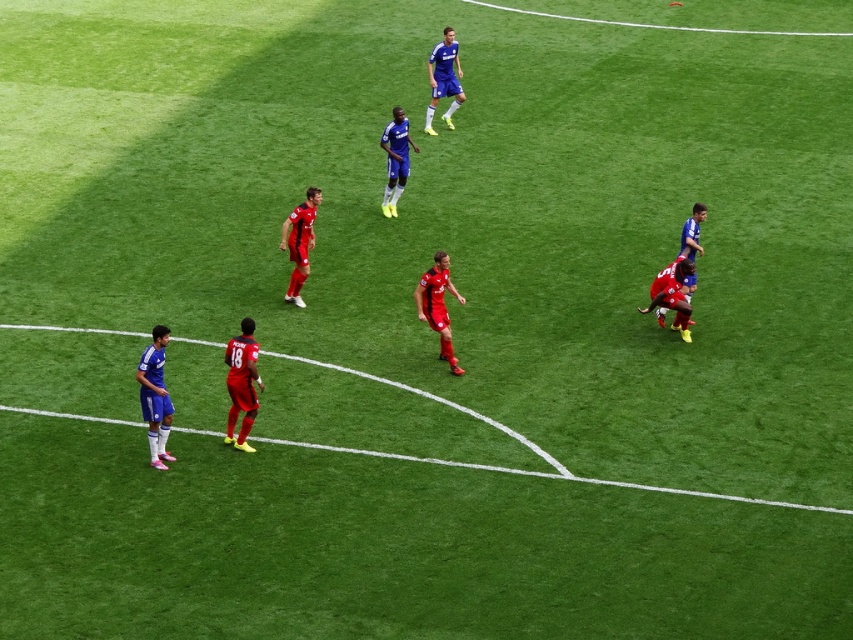
You are a soccer fan watching the match from the sidelines. You notice the shiny red shorts at lower left and the shiny red soccer player at center. Which one do you see first as you look from the sidelines towards the field?

The shiny red shorts at lower left are closer to the viewer than the shiny red soccer player at center, so you would see the shiny red shorts at lower left first when looking from the sidelines towards the field.

You are a soccer player positioned at the center of the field. You need to pass the ball to the teammate wearing the blue jersey at lower left. Based on the field coordinates, in which general direction should you aim your pass?

The blue jersey at lower left is located at coordinates 0.620 on the x axis and 0.183 on the y axis. Since the center of the field is at coordinates 0.5 on both axes, the blue jersey at lower left is positioned to the right and slightly forward from your current position. Therefore, you should aim your pass to the right and slightly forward direction.

You are a soccer player positioned at the point with coordinates point (293, 234). You need to pass the ball to your teammate located at point (692, 266). Considering the positions of both points, which direction should you aim your pass to ensure it reaches your teammate?

You should aim your pass towards the direction of point (692, 266), which is in front of point (293, 234), ensuring the ball travels forward to reach your teammate.